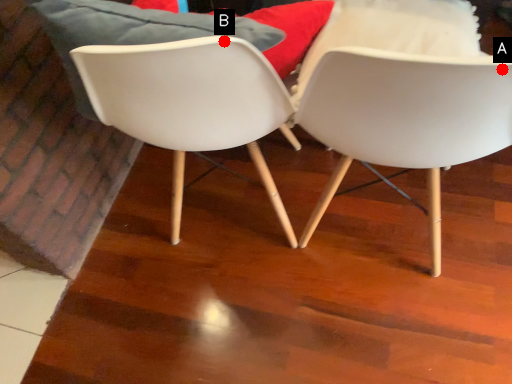
Question: Two points are circled on the image, labeled by A and B beside each circle. Which point is closer to the camera?

Choices:
 (A) A is closer
 (B) B is closer

Answer: (A)